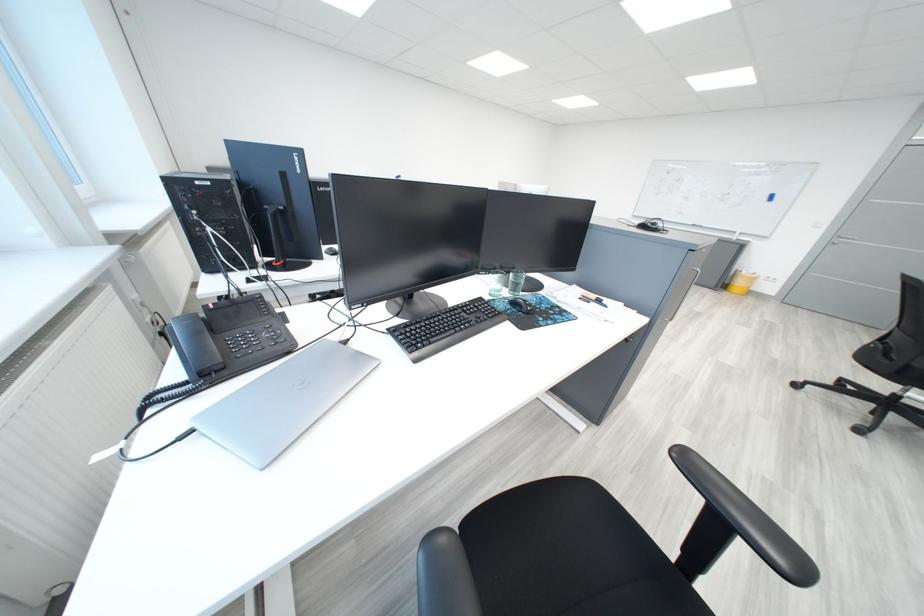
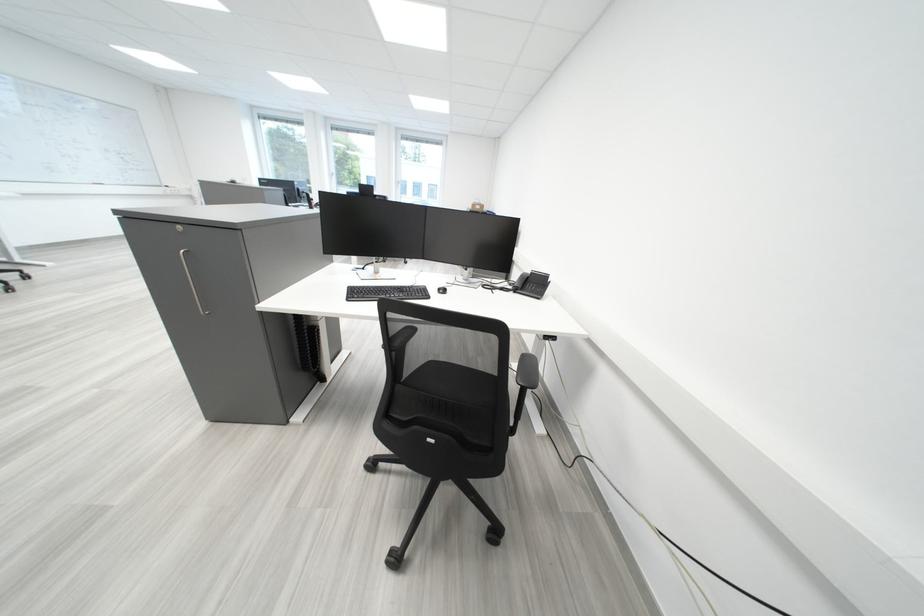
Question: I am providing you with two images of the same scene from different viewpoints. After the viewpoint changes to image2, which objects are now occluded?

Choices:
 (A) silver cabinet handle
 (B) black chair armrest
 (C) brown leather boot
 (D) black computer mouse

Answer: (D)